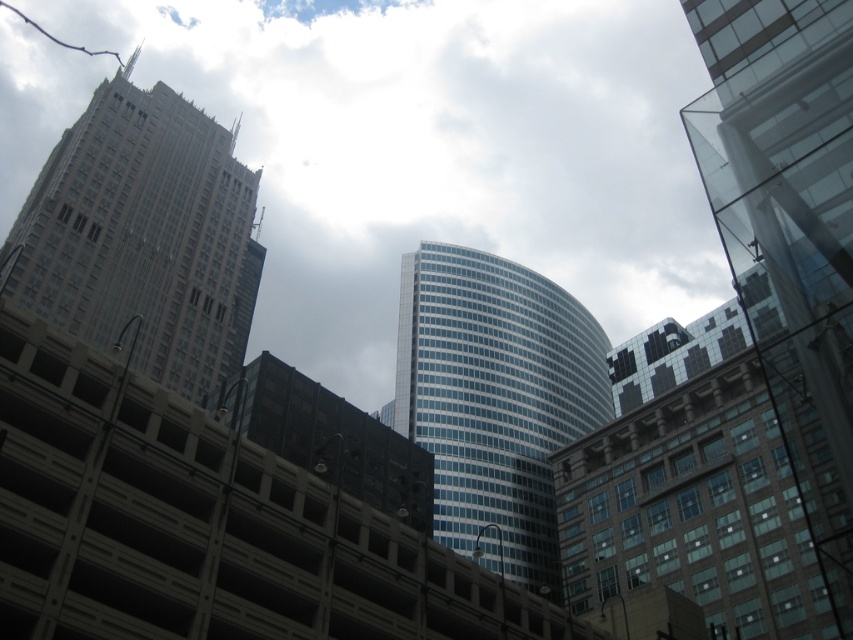
Question: Does gray stone skyscraper at left have a larger size compared to glassy blue skyscraper at center?

Choices:
 (A) yes
 (B) no

Answer: (B)

Question: Does transparent glass building at upper center come in front of glassy blue skyscraper at center?

Choices:
 (A) no
 (B) yes

Answer: (A)

Question: Does transparent glass building at upper center come behind gray stone skyscraper at left?

Choices:
 (A) no
 (B) yes

Answer: (B)

Question: Which point is farther to the camera?

Choices:
 (A) gray stone skyscraper at left
 (B) glassy blue skyscraper at center
 (C) transparent glass building at upper center

Answer: (C)

Question: Which point appears farthest from the camera in this image?

Choices:
 (A) (218, 280)
 (B) (578, 67)
 (C) (514, 300)

Answer: (B)

Question: Which object is the farthest from the glassy blue skyscraper at center?

Choices:
 (A) gray stone skyscraper at left
 (B) transparent glass building at upper center

Answer: (B)